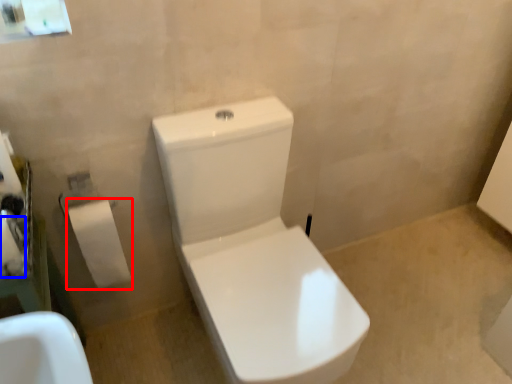
Question: Which point is closer to the camera, toiletry (highlighted by a red box) or toilet paper (highlighted by a blue box)?

Choices:
 (A) toiletry
 (B) toilet paper

Answer: (B)